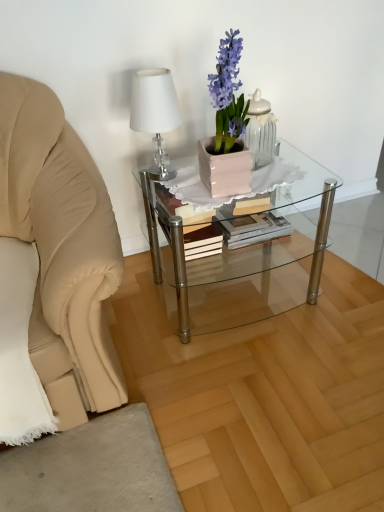
Question: Are matte pink pot at center and clear glass coffee table at center beside each other?

Choices:
 (A) no
 (B) yes

Answer: (A)

Question: From the image's perspective, is matte pink pot at center on top of clear glass coffee table at center?

Choices:
 (A) no
 (B) yes

Answer: (B)

Question: Is matte pink pot at center not within clear glass coffee table at center?

Choices:
 (A) yes
 (B) no

Answer: (A)

Question: Is matte pink pot at center to the right of clear glass coffee table at center from the viewer's perspective?

Choices:
 (A) no
 (B) yes

Answer: (A)

Question: Is matte pink pot at center positioned before clear glass coffee table at center?

Choices:
 (A) no
 (B) yes

Answer: (B)

Question: Is the depth of matte pink pot at center greater than that of clear glass coffee table at center?

Choices:
 (A) no
 (B) yes

Answer: (A)

Question: Does white glossy table lamp at upper left have a smaller size compared to matte pink pot at center?

Choices:
 (A) yes
 (B) no

Answer: (A)

Question: Is white glossy table lamp at upper left oriented away from matte pink pot at center?

Choices:
 (A) yes
 (B) no

Answer: (B)

Question: Is the depth of white glossy table lamp at upper left greater than that of matte pink pot at center?

Choices:
 (A) no
 (B) yes

Answer: (B)

Question: From the image's perspective, would you say white glossy table lamp at upper left is shown under matte pink pot at center?

Choices:
 (A) yes
 (B) no

Answer: (A)

Question: From a real-world perspective, is white glossy table lamp at upper left positioned under matte pink pot at center based on gravity?

Choices:
 (A) no
 (B) yes

Answer: (B)

Question: Are white glossy table lamp at upper left and matte pink pot at center located far from each other?

Choices:
 (A) yes
 (B) no

Answer: (B)

Question: Is matte pink pot at center a part of clear glass coffee table at center?

Choices:
 (A) no
 (B) yes

Answer: (A)